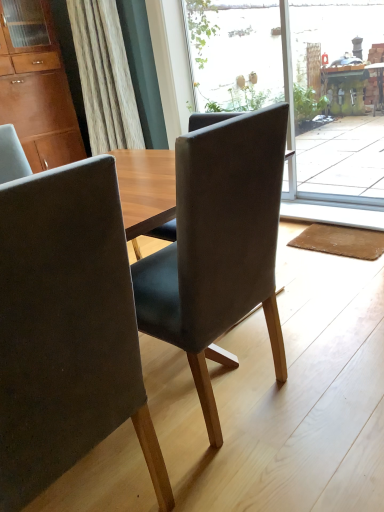
Question: Considering the positions of brown fabric mat at lower right and matte brown cabinet at upper left in the image, is brown fabric mat at lower right wider or thinner than matte brown cabinet at upper left?

Choices:
 (A) thin
 (B) wide

Answer: (A)

Question: In terms of height, does brown fabric mat at lower right look taller or shorter compared to matte brown cabinet at upper left?

Choices:
 (A) short
 (B) tall

Answer: (A)

Question: Which object is positioned closest to the matte brown cabinet at upper left?

Choices:
 (A) matte gray chair at center, the first chair viewed from the left
 (B) brown fabric mat at lower right
 (C) suede-like gray chair at center, positioned as the 1th chair in right-to-left order
 (D) transparent glass screen door at upper right
 (E) transparent glass door at center

Answer: (B)

Question: Which of these objects is positioned farthest from the suede-like gray chair at center, the 2th chair positioned from the left?

Choices:
 (A) transparent glass door at center
 (B) matte brown cabinet at upper left
 (C) matte gray chair at center, which is counted as the 2th chair, starting from the right
 (D) brown fabric mat at lower right
 (E) transparent glass screen door at upper right

Answer: (E)